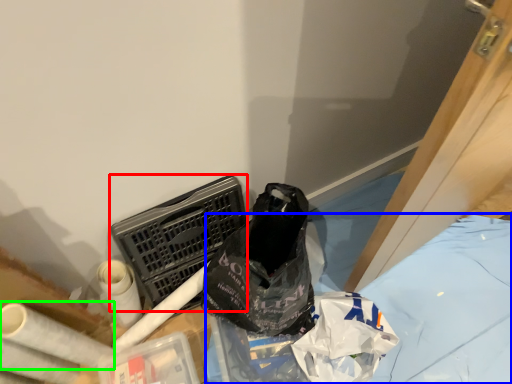
Question: Based on their relative distances, which object is farther from laundry basket (highlighted by a red box)? Choose from sheet (highlighted by a blue box) and toilet paper (highlighted by a green box).

Choices:
 (A) sheet
 (B) toilet paper

Answer: (A)